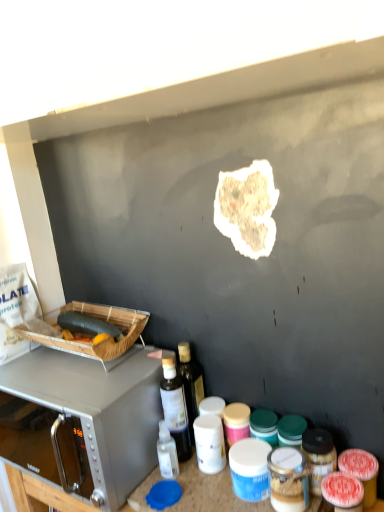
At what (x,y) coordinates should I click in order to perform the action: click on vacant area that is in front of translucent plastic bottle at center. Please return your answer as a coordinate pair (x, y). The height and width of the screenshot is (512, 384). Looking at the image, I should click on (197, 489).